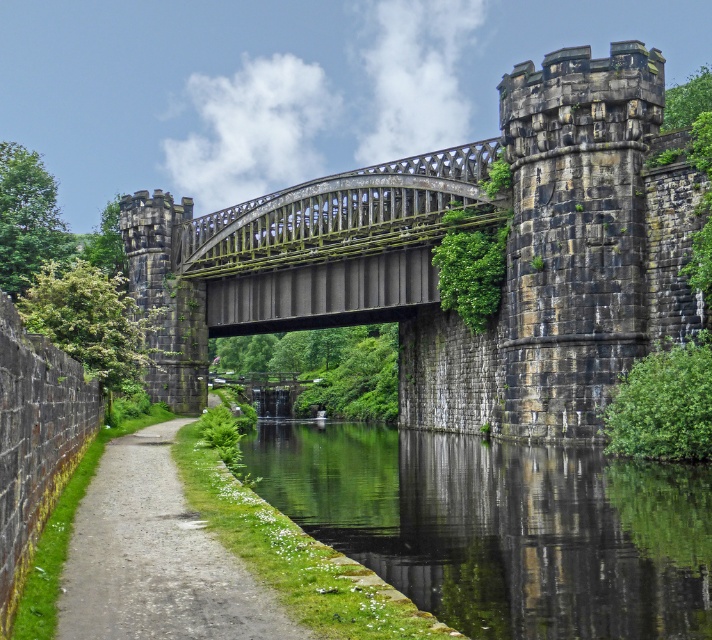
Based on the photo, you are a tourist standing on the bridge and want to take a photo of the stone castle at center and the green reflective water at center. Which object should you focus on first to ensure both are in the frame?

You should focus on the stone castle at center first because the green reflective water at center is behind it, so positioning the camera to include the castle will naturally include the water in the background as well.

You are standing at the camera position and want to reach point (182,228). The bridge has a maximum load capacity of 400 feet. Will you be able to cross the bridge to reach that point?

The distance between point (182,228) and the camera is 399.33 feet, which is under the bridge maximum load capacity of 400 feet. Therefore, you can safely cross the bridge to reach that point.